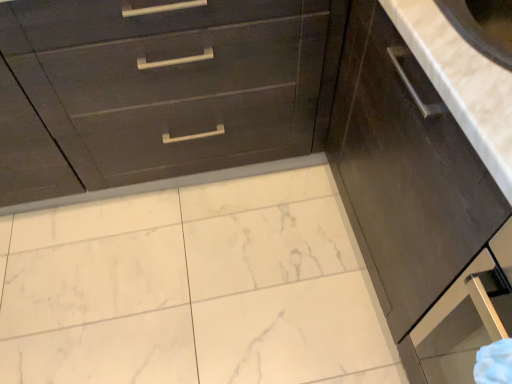
Where is `dark wood cabinet at right`? dark wood cabinet at right is located at coordinates (405, 172).

Which point is more forward, [479,107] or [425,237]?

The point [479,107] is closer.

Considering the relative sizes of white marble countertop at upper right and dark wood cabinet at right in the image provided, is white marble countertop at upper right wider than dark wood cabinet at right?

Incorrect, the width of white marble countertop at upper right does not surpass that of dark wood cabinet at right.

Which is correct: white marble countertop at upper right is inside dark wood cabinet at right, or outside of it?

white marble countertop at upper right exists entirely within dark wood cabinet at right.

Locate an element on the screen. This screenshot has width=512, height=384. chest of drawers that is on the left side of white marble countertop at upper right is located at coordinates (172, 86).

Is white marble countertop at upper right located outside dark wood drawer at upper left?

Absolutely, white marble countertop at upper right is external to dark wood drawer at upper left.

Does white marble countertop at upper right lie in front of dark wood drawer at upper left?

Yes, it is in front of dark wood drawer at upper left.

Which object is further away from the camera, dark wood cabinet at right or white marble countertop at upper right?

white marble countertop at upper right.

Is white marble countertop at upper right at the back of dark wood cabinet at right?

That's not correct — dark wood cabinet at right is not looking away from white marble countertop at upper right.

How many degrees apart are the facing directions of dark wood cabinet at right and white marble countertop at upper right?

0.78 degrees.

Visually, is dark wood cabinet at right positioned to the left or to the right of white marble countertop at upper right?

In the image, dark wood cabinet at right appears on the right side of white marble countertop at upper right.

Measure the distance from dark wood cabinet at right to dark wood drawer at upper left.

A distance of 43.37 centimeters exists between dark wood cabinet at right and dark wood drawer at upper left.

Does dark wood cabinet at right have a greater width compared to dark wood drawer at upper left?

No, dark wood cabinet at right is not wider than dark wood drawer at upper left.

Would you say dark wood cabinet at right is to the left or to the right of dark wood drawer at upper left in the picture?

From the image, it's evident that dark wood cabinet at right is to the right of dark wood drawer at upper left.

In terms of height, does dark wood cabinet at right look taller or shorter compared to dark wood drawer at upper left?

dark wood cabinet at right is shorter than dark wood drawer at upper left.

From a real-world perspective, is dark wood drawer at upper left on top of dark wood cabinet at right?

Actually, dark wood drawer at upper left is physically below dark wood cabinet at right in the real world.

Is dark wood cabinet at right a part of dark wood drawer at upper left?

No, dark wood cabinet at right is not a part of dark wood drawer at upper left.

Which is behind, point (225, 112) or point (395, 123)?

The point (225, 112) is behind.

Consider the image. Is dark wood drawer at upper left oriented away from dark wood cabinet at right?

dark wood drawer at upper left does not have its back to dark wood cabinet at right.

Who is bigger, dark wood drawer at upper left or white marble countertop at upper right?

With larger size is dark wood drawer at upper left.

Which point is more forward, [75,86] or [470,124]?

The point [470,124] is more forward.

Would you say dark wood drawer at upper left contains white marble countertop at upper right?

No, white marble countertop at upper right is not surrounded by dark wood drawer at upper left.

Does dark wood drawer at upper left have a greater height compared to white marble countertop at upper right?

Correct, dark wood drawer at upper left is much taller as white marble countertop at upper right.

Locate an element on the screen. Image resolution: width=512 pixels, height=384 pixels. counter top on the left of dark wood cabinet at right is located at coordinates (462, 82).

At what (x,y) coordinates should I click in order to perform the action: click on counter top in front of the dark wood drawer at upper left. Please return your answer as a coordinate pair (x, y). The width and height of the screenshot is (512, 384). Looking at the image, I should click on (462, 82).

Which object lies further to the anchor point dark wood drawer at upper left, white marble countertop at upper right or dark wood cabinet at right?

Among the two, white marble countertop at upper right is located further to dark wood drawer at upper left.

Which object lies nearer to the anchor point white marble countertop at upper right, dark wood cabinet at right or dark wood drawer at upper left?

dark wood cabinet at right.

When comparing their distances from white marble countertop at upper right, does dark wood drawer at upper left or dark wood cabinet at right seem closer?

Based on the image, dark wood cabinet at right appears to be nearer to white marble countertop at upper right.

Which object lies nearer to the anchor point dark wood drawer at upper left, dark wood cabinet at right or white marble countertop at upper right?

dark wood cabinet at right lies closer to dark wood drawer at upper left than the other object.

Looking at the image, which one is located further to dark wood cabinet at right, dark wood drawer at upper left or white marble countertop at upper right?

The object further to dark wood cabinet at right is dark wood drawer at upper left.

When comparing their distances from dark wood cabinet at right, does white marble countertop at upper right or dark wood drawer at upper left seem closer?

white marble countertop at upper right lies closer to dark wood cabinet at right than the other object.

Locate an element on the screen. The width and height of the screenshot is (512, 384). counter top between dark wood drawer at upper left and dark wood cabinet at right is located at coordinates (462, 82).